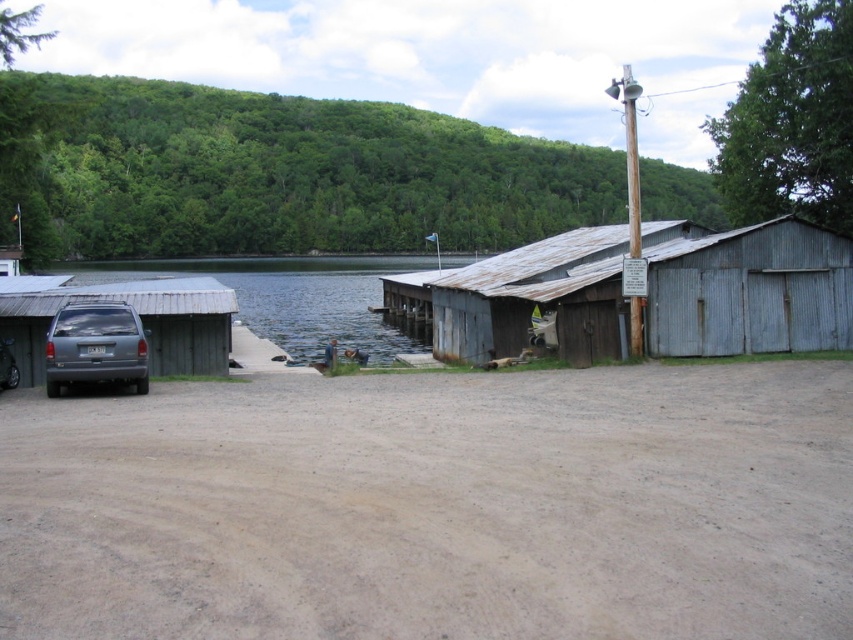
Question: Can you confirm if brown dirt track at lower center is smaller than rusty corrugated metal barn at center-right?

Choices:
 (A) no
 (B) yes

Answer: (B)

Question: Which object appears farthest from the camera in this image?

Choices:
 (A) rusty corrugated metal barn at center-right
 (B) satin gray suv at lower left
 (C) matte gray van at left
 (D) brown dirt track at lower center

Answer: (A)

Question: Which object is closer to the camera taking this photo?

Choices:
 (A) rusty corrugated metal barn at center-right
 (B) satin gray suv at lower left

Answer: (B)

Question: Which object is positioned farthest from the rusty corrugated metal barn at center-right?

Choices:
 (A) satin gray suv at lower left
 (B) brown dirt track at lower center
 (C) clear water at dock left
 (D) matte gray van at left

Answer: (C)

Question: Can you confirm if brown dirt track at lower center is smaller than satin gray suv at lower left?

Choices:
 (A) yes
 (B) no

Answer: (B)

Question: Can you confirm if brown dirt track at lower center is thinner than satin gray suv at lower left?

Choices:
 (A) no
 (B) yes

Answer: (A)